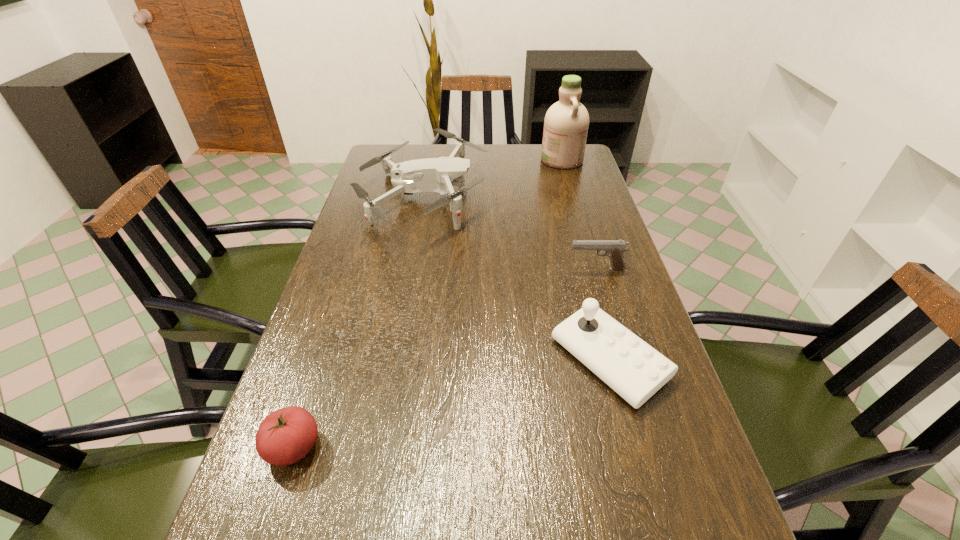
Identify the location of the tallest object. (566, 123).

Identify the location of drone. (432, 174).

Find the location of a particular element. The image size is (960, 540). joystick is located at coordinates (632, 368).

You are a GUI agent. You are given a task and a screenshot of the screen. Output one action in this format:
    pyautogui.click(x=<x>, y=<y>)
    Task: Click on the tomato
    
    Given the screenshot: What is the action you would take?
    pyautogui.click(x=285, y=436)

This screenshot has width=960, height=540. In order to click on the fourth nearest object in this screenshot , I will do `click(614, 249)`.

Where is `free spot located on the front label of the cleansing agent`? This screenshot has width=960, height=540. free spot located on the front label of the cleansing agent is located at coordinates (457, 160).

Find the location of a particular element. vacant position located on the front label of the cleansing agent is located at coordinates (452, 160).

The height and width of the screenshot is (540, 960). Find the location of `free space located 0.290m on the front label of the cleansing agent`. free space located 0.290m on the front label of the cleansing agent is located at coordinates (463, 160).

The width and height of the screenshot is (960, 540). In order to click on vacant space located 0.340m with a camera at the front of the drone in this screenshot , I will do pyautogui.click(x=593, y=199).

The image size is (960, 540). Find the location of `vacant space located 0.200m on the left of the joystick`. vacant space located 0.200m on the left of the joystick is located at coordinates (462, 360).